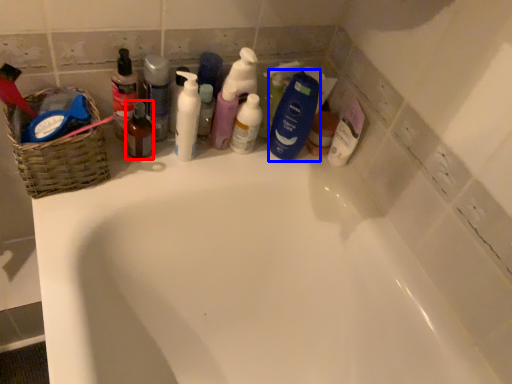
Question: Which object appears closest to the camera in this image, mouthwash (highlighted by a red box) or cleaning product (highlighted by a blue box)?

Choices:
 (A) mouthwash
 (B) cleaning product

Answer: (A)